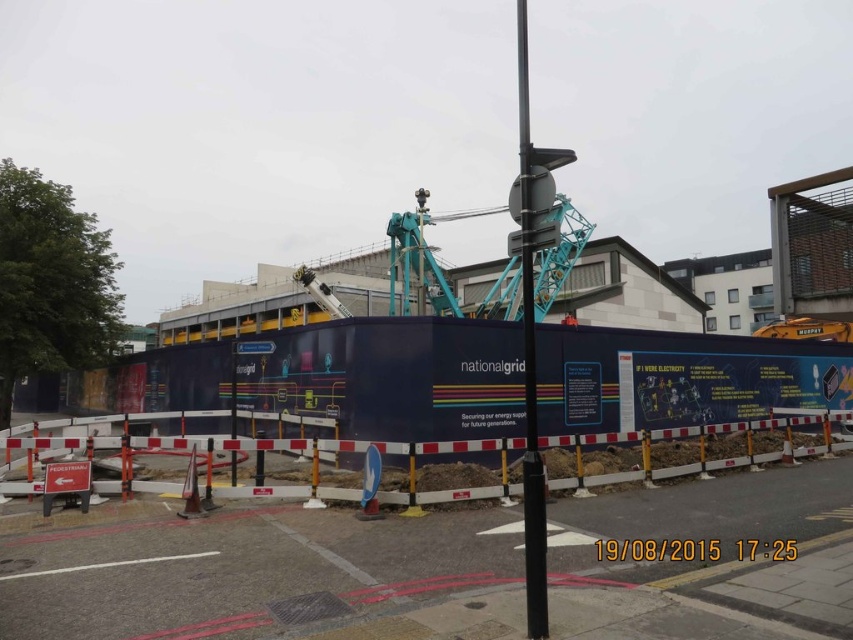
You are a pedestrian approaching the construction site. You see the white plastic barrier at lower center and the orange fabric construction worker at center. Which object is closer to you as you approach the scene?

The white plastic barrier at lower center is closer to you because it is positioned in front of the orange fabric construction worker at center.

Based on the photo, you are a delivery driver who needs to park your truck near the construction site. The truck has a GPS that marks a specific point at coordinates (259, 572). According to the scene, what object is located at that point?

The point at coordinates (259, 572) corresponds to the blue and white construction barrier at center, so the delivery driver should park near the blue and white construction barrier at center.